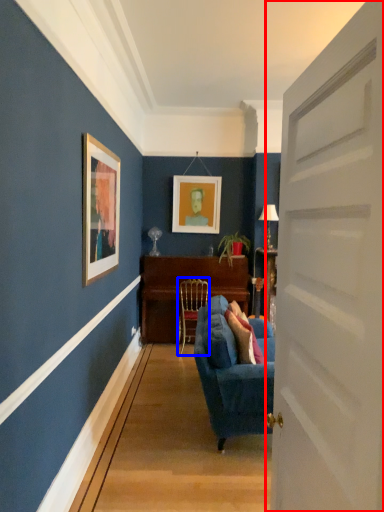
Question: Which of the following is the farthest to the observer, door (highlighted by a red box) or chair (highlighted by a blue box)?

Choices:
 (A) door
 (B) chair

Answer: (B)